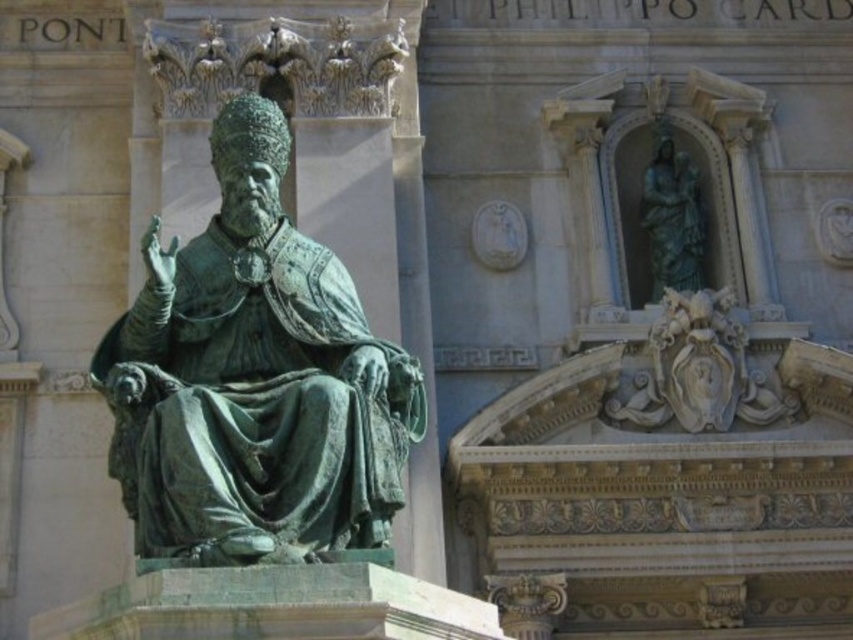
Question: Is green patina bronze statue at center further to camera compared to white stone ornament at upper center?

Choices:
 (A) yes
 (B) no

Answer: (B)

Question: Estimate the real-world distances between objects in this image. Which object is closer to the green patina bronze statue at center?

Choices:
 (A) green patina statue at upper center
 (B) white stone ornament at upper center

Answer: (B)

Question: In this image, where is green patina bronze statue at center located relative to white stone ornament at upper center?

Choices:
 (A) left
 (B) right

Answer: (A)

Question: Estimate the real-world distances between objects in this image. Which object is farther from the white stone ornament at upper center?

Choices:
 (A) green patina bronze statue at center
 (B) green patina statue at upper center

Answer: (A)

Question: Is green patina bronze statue at center positioned before green patina statue at upper center?

Choices:
 (A) yes
 (B) no

Answer: (A)

Question: Which of the following is the farthest from the observer?

Choices:
 (A) green patina bronze statue at center
 (B) white stone ornament at upper center

Answer: (B)